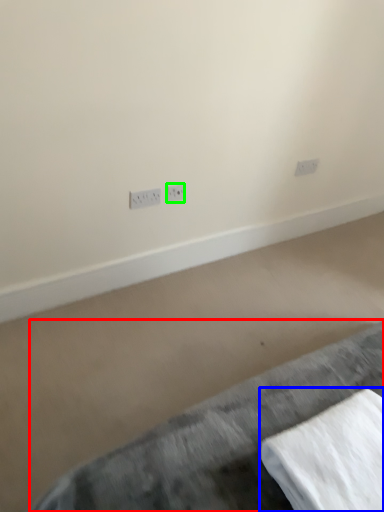
Question: Based on their relative distances, which object is farther from furniture (highlighted by a red box)? Choose from linen (highlighted by a blue box) and power plugs and sockets (highlighted by a green box).

Choices:
 (A) linen
 (B) power plugs and sockets

Answer: (B)